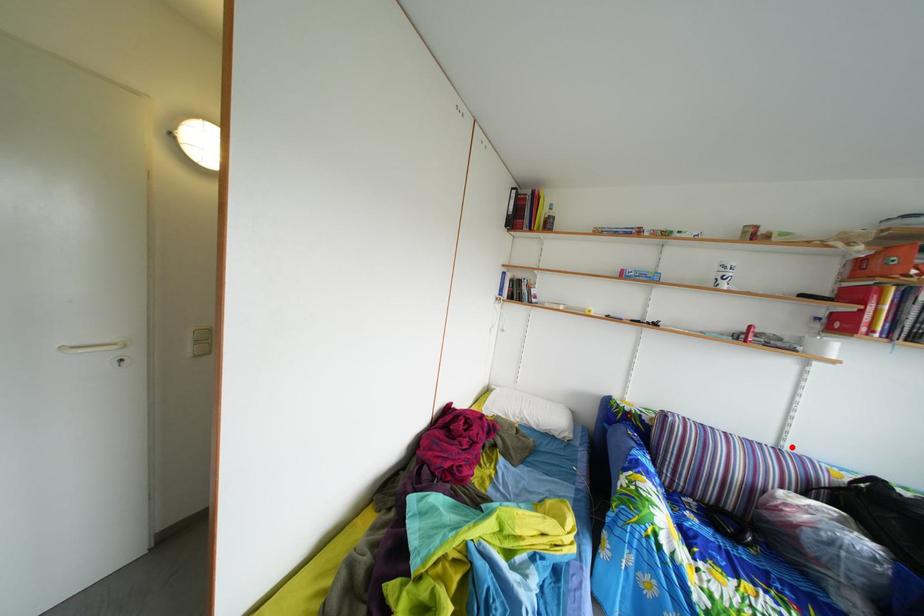
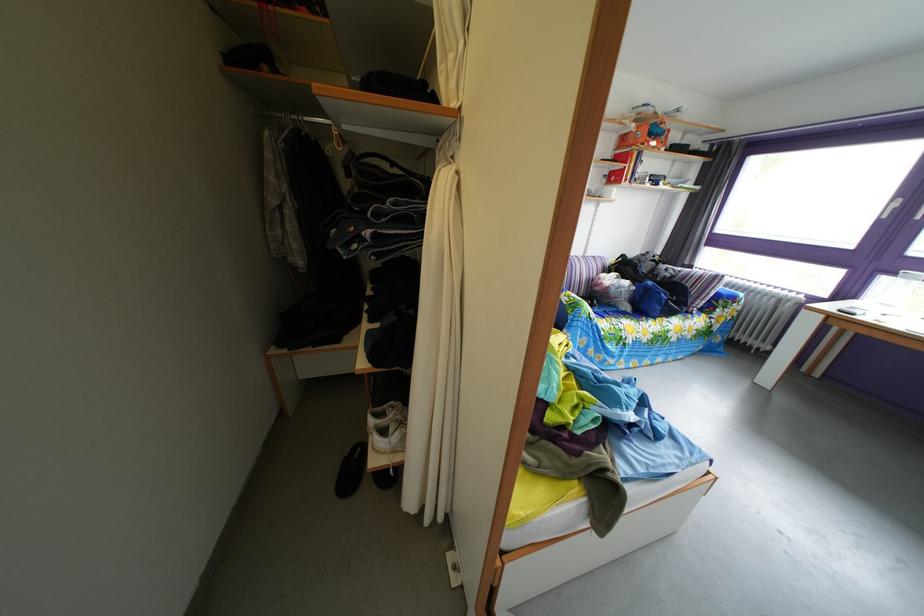
Question: I am providing you with two images of the same scene from different viewpoints. A red point is marked on the first image. Can you still see the location of the red point in image 2?

Choices:
 (A) Yes
 (B) No

Answer: (A)